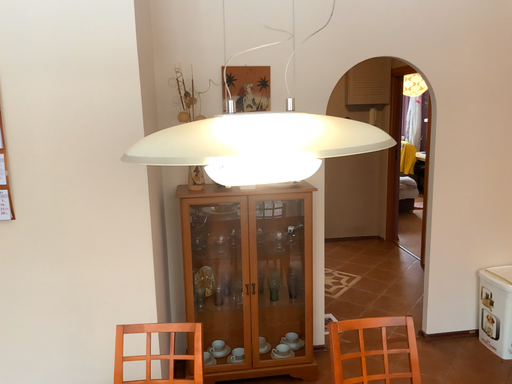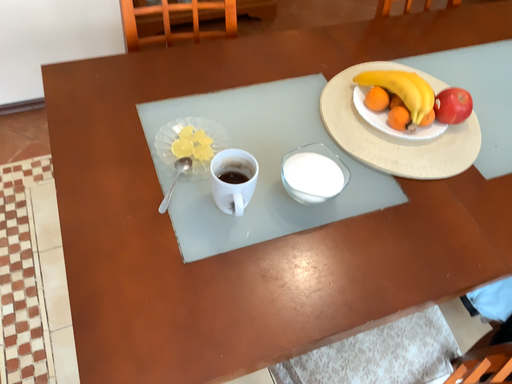
Question: How did the camera likely rotate when shooting the video?

Choices:
 (A) rotated right
 (B) rotated left

Answer: (A)